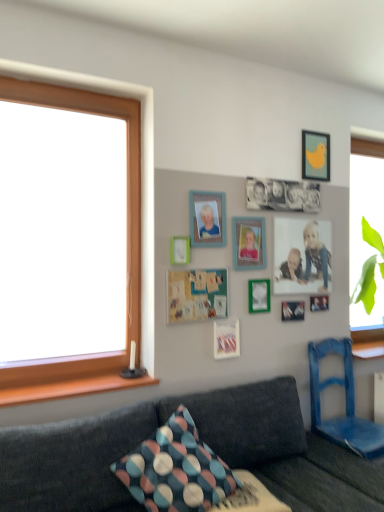
Question: Considering the relative sizes of matte plastic photo frame at upper center, arranged as the 5th picture frame when viewed from the right, and green matte picture frame at center, marked as the fourth picture frame in a left-to-right arrangement, in the image provided, is matte plastic photo frame at upper center, arranged as the 5th picture frame when viewed from the right, thinner than green matte picture frame at center, marked as the fourth picture frame in a left-to-right arrangement,?

Choices:
 (A) yes
 (B) no

Answer: (B)

Question: From a real-world perspective, is matte plastic photo frame at upper center, arranged as the 5th picture frame when viewed from the right, on green matte picture frame at center, which is the 3th picture frame from right to left?

Choices:
 (A) yes
 (B) no

Answer: (A)

Question: Is matte plastic photo frame at upper center, the second picture frame positioned from the left, turned away from green matte picture frame at center, which is the 3th picture frame from right to left?

Choices:
 (A) no
 (B) yes

Answer: (A)

Question: From the image's perspective, is matte plastic photo frame at upper center, the second picture frame positioned from the left, below green matte picture frame at center, which is the 3th picture frame from right to left?

Choices:
 (A) no
 (B) yes

Answer: (A)

Question: Is matte plastic photo frame at upper center, the second picture frame positioned from the left, further to camera compared to green matte picture frame at center, marked as the fourth picture frame in a left-to-right arrangement?

Choices:
 (A) no
 (B) yes

Answer: (A)

Question: Relative to wooden at left, is matte white picture frame at center, acting as the sixth picture frame starting from the right, in front or behind?

Choices:
 (A) behind
 (B) front

Answer: (A)

Question: From a real-world perspective, is matte white picture frame at center, acting as the sixth picture frame starting from the right, physically located above or below wooden at left?

Choices:
 (A) below
 (B) above

Answer: (B)

Question: Visually, is matte white picture frame at center, the 1th picture frame in the left-to-right sequence, positioned to the left or to the right of wooden at left?

Choices:
 (A) right
 (B) left

Answer: (A)

Question: Looking at the image, does matte white picture frame at center, the 1th picture frame in the left-to-right sequence, seem bigger or smaller compared to wooden at left?

Choices:
 (A) small
 (B) big

Answer: (A)

Question: From the image's perspective, relative to matte white picture frame at center, acting as the sixth picture frame starting from the right, is matte wooden frame at lower right, which is the fourth decorative picture from left to right, above or below?

Choices:
 (A) above
 (B) below

Answer: (B)

Question: In terms of height, does matte wooden frame at lower right, placed as the 3th decorative picture when sorted from bottom to top, look taller or shorter compared to matte white picture frame at center, the 1th picture frame in the left-to-right sequence?

Choices:
 (A) tall
 (B) short

Answer: (B)

Question: Considering the positions of point (321, 294) and point (183, 238), is point (321, 294) closer or farther from the camera than point (183, 238)?

Choices:
 (A) farther
 (B) closer

Answer: (A)

Question: In terms of size, does matte wooden frame at lower right, the 2th decorative picture in the top-to-bottom sequence, appear bigger or smaller than matte white picture frame at center, acting as the sixth picture frame starting from the right?

Choices:
 (A) small
 (B) big

Answer: (A)

Question: Considering the positions of point (195, 202) and point (311, 309), is point (195, 202) closer or farther from the camera than point (311, 309)?

Choices:
 (A) closer
 (B) farther

Answer: (A)

Question: From their relative heights in the image, would you say matte plastic photo frame at upper center, the second picture frame positioned from the left, is taller or shorter than matte wooden frame at lower right, placed as the 3th decorative picture when sorted from bottom to top?

Choices:
 (A) tall
 (B) short

Answer: (A)